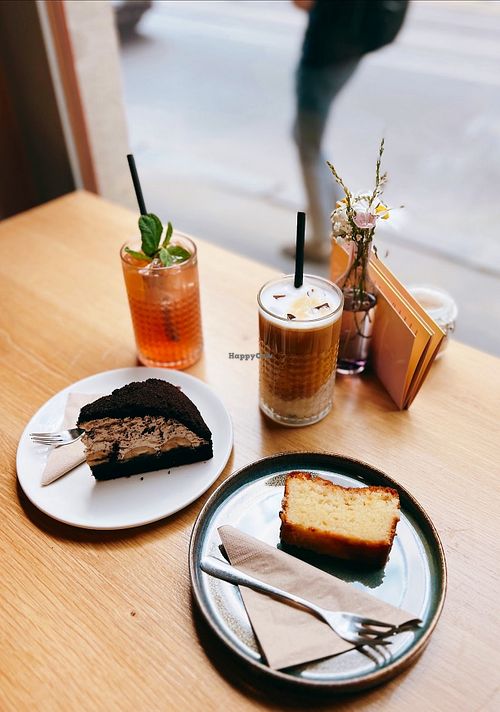
At what (x,y) coordinates should I click in order to perform the action: click on glass. Please return your answer as a coordinate pair (x, y). Looking at the image, I should click on (313, 350).